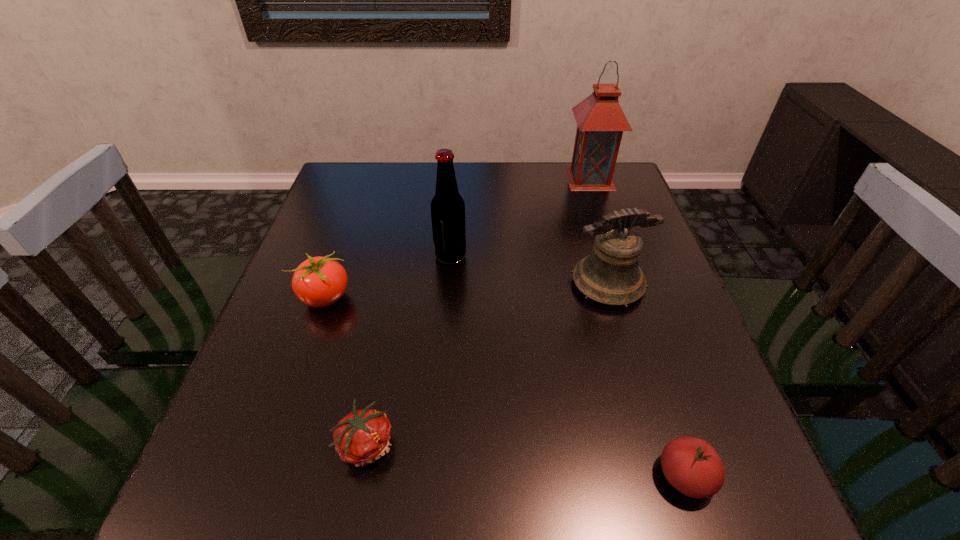
The image size is (960, 540). In order to click on object that is at the far right corner in this screenshot , I will do `click(600, 119)`.

What are the coordinates of `object at the near right corner` in the screenshot? It's located at (691, 465).

You are a GUI agent. You are given a task and a screenshot of the screen. Output one action in this format:
    pyautogui.click(x=<x>, y=<y>)
    Task: Click on the free location at the far edge of the desktop
    The height and width of the screenshot is (540, 960).
    Given the screenshot: What is the action you would take?
    tap(396, 206)

In order to click on free space at the left edge in this screenshot , I will do `click(317, 231)`.

This screenshot has width=960, height=540. Identify the location of free space at the right edge of the desktop. (620, 323).

Locate an element on the screen. This screenshot has height=540, width=960. vacant space at the far left corner of the desktop is located at coordinates (x=378, y=185).

In order to click on vacant space at the near left corner in this screenshot , I will do `click(266, 515)`.

Identify the location of vacant space at the near right corner of the desktop. Image resolution: width=960 pixels, height=540 pixels. (782, 527).

Find the location of a particular element. unoccupied position between the rightmost tomato and the second tomato from left to right is located at coordinates (526, 460).

Where is `blank region between the second tallest object and the farthest object`? This screenshot has width=960, height=540. blank region between the second tallest object and the farthest object is located at coordinates (520, 217).